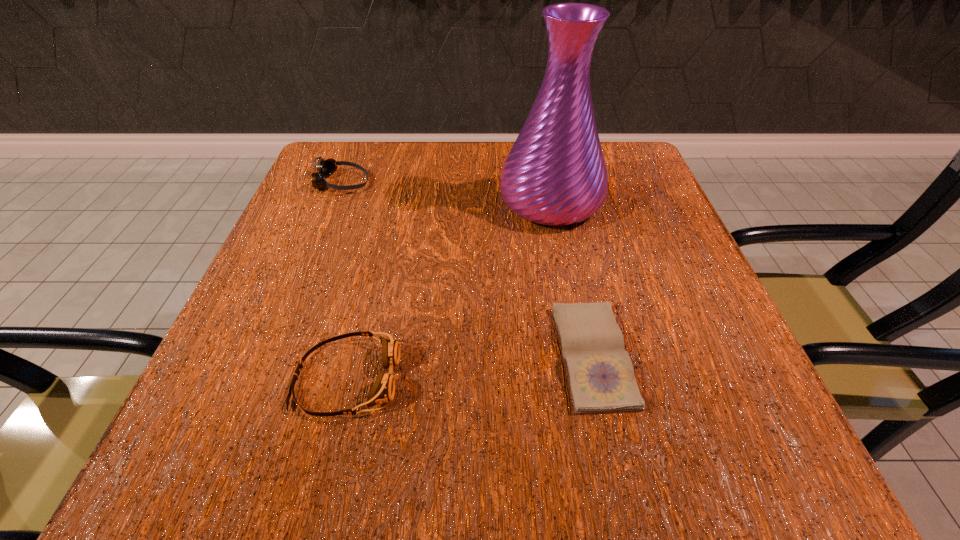
The image size is (960, 540). What are the coordinates of `free space between the tallest object and the nearer goggles` in the screenshot? It's located at (448, 290).

At what (x,y) coordinates should I click in order to perform the action: click on free space between the shortest object and the vase. Please return your answer as a coordinate pair (x, y). The image size is (960, 540). Looking at the image, I should click on (572, 279).

At what (x,y) coordinates should I click in order to perform the action: click on vacant region between the nearer goggles and the farther goggles. Please return your answer as a coordinate pair (x, y). This screenshot has width=960, height=540. Looking at the image, I should click on (344, 281).

Find the location of a particular element. This screenshot has height=540, width=960. free space between the vase and the farther goggles is located at coordinates (446, 192).

Identify which object is located as the second nearest to the nearer goggles. Please provide its 2D coordinates. Your answer should be formatted as a tuple, i.e. [(x, y)], where the tuple contains the x and y coordinates of a point satisfying the conditions above.

[(555, 174)]

The height and width of the screenshot is (540, 960). I want to click on the closest object relative to the farther goggles, so click(555, 174).

The width and height of the screenshot is (960, 540). Identify the location of free space that satisfies the following two spatial constraints: 1. through the lenses of the farther goggles; 2. on the left side of the diary. (273, 355).

In order to click on free space in the image that satisfies the following two spatial constraints: 1. through the lenses of the farther goggles; 2. on the right side of the vase in this screenshot , I will do `click(334, 201)`.

In order to click on free spot that satisfies the following two spatial constraints: 1. on the front side of the tallest object; 2. on the right side of the shortest object in this screenshot , I will do `click(580, 355)`.

This screenshot has width=960, height=540. In order to click on free location that satisfies the following two spatial constraints: 1. through the lenses of the farther goggles; 2. on the left side of the vase in this screenshot , I will do `click(334, 201)`.